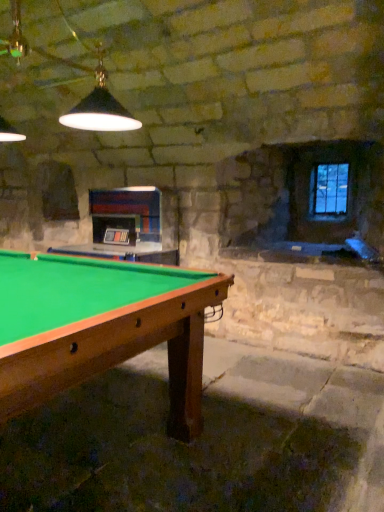
Question: In terms of height, does green felt pool table at center look taller or shorter compared to blue glass window at upper right?

Choices:
 (A) short
 (B) tall

Answer: (B)

Question: Looking at their shapes, would you say green felt pool table at center is wider or thinner than blue glass window at upper right?

Choices:
 (A) wide
 (B) thin

Answer: (A)

Question: From a real-world perspective, is green felt pool table at center physically located above or below blue glass window at upper right?

Choices:
 (A) below
 (B) above

Answer: (A)

Question: Relative to green felt pool table at center, is blue glass window at upper right in front or behind?

Choices:
 (A) front
 (B) behind

Answer: (B)

Question: Considering the positions of blue glass window at upper right and green felt pool table at center in the image, is blue glass window at upper right bigger or smaller than green felt pool table at center?

Choices:
 (A) big
 (B) small

Answer: (B)

Question: Considering the positions of blue glass window at upper right and green felt pool table at center in the image, is blue glass window at upper right taller or shorter than green felt pool table at center?

Choices:
 (A) short
 (B) tall

Answer: (A)

Question: Looking at their shapes, would you say blue glass window at upper right is wider or thinner than green felt pool table at center?

Choices:
 (A) thin
 (B) wide

Answer: (A)